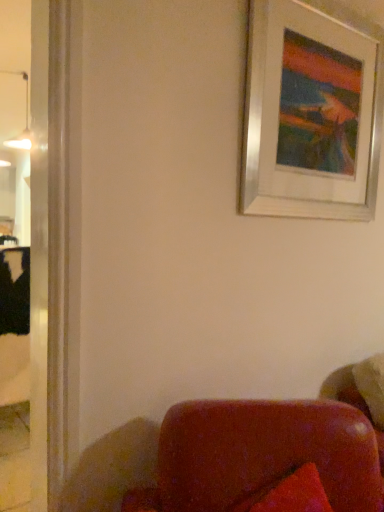
This screenshot has width=384, height=512. Describe the element at coordinates (312, 111) in the screenshot. I see `silver metallic picture frame at upper right` at that location.

Find the location of a particular element. silver metallic picture frame at upper right is located at coordinates (312, 111).

Image resolution: width=384 pixels, height=512 pixels. Describe the element at coordinates (26, 117) in the screenshot. I see `matte white lamp at upper left` at that location.

The width and height of the screenshot is (384, 512). I want to click on matte white lamp at upper left, so click(26, 117).

Where is `silver metallic picture frame at upper right`? This screenshot has height=512, width=384. silver metallic picture frame at upper right is located at coordinates (312, 111).

Is matte white lamp at upper left to the left of silver metallic picture frame at upper right from the viewer's perspective?

Indeed, matte white lamp at upper left is positioned on the left side of silver metallic picture frame at upper right.

Is matte white lamp at upper left closer to the viewer compared to silver metallic picture frame at upper right?

No, matte white lamp at upper left is behind silver metallic picture frame at upper right.

Is point (26, 106) in front of point (315, 187)?

No, (26, 106) is behind (315, 187).

From the image's perspective, between matte white lamp at upper left and silver metallic picture frame at upper right, who is located below?

silver metallic picture frame at upper right, from the image's perspective.

From a real-world perspective, does matte white lamp at upper left stand above silver metallic picture frame at upper right?

Indeed, from a real-world perspective, matte white lamp at upper left stands above silver metallic picture frame at upper right.

Looking at their sizes, would you say matte white lamp at upper left is wider or thinner than silver metallic picture frame at upper right?

matte white lamp at upper left is wider than silver metallic picture frame at upper right.

Can you confirm if matte white lamp at upper left is taller than silver metallic picture frame at upper right?

No.

Does matte white lamp at upper left have a smaller size compared to silver metallic picture frame at upper right?

Correct, matte white lamp at upper left occupies less space than silver metallic picture frame at upper right.

Is matte white lamp at upper left spatially inside silver metallic picture frame at upper right, or outside of it?

matte white lamp at upper left is located beyond the bounds of silver metallic picture frame at upper right.

Is matte white lamp at upper left positioned far away from silver metallic picture frame at upper right?

matte white lamp at upper left is far away from silver metallic picture frame at upper right.

Is matte white lamp at upper left oriented away from silver metallic picture frame at upper right?

That's not correct — matte white lamp at upper left is not looking away from silver metallic picture frame at upper right.

How far apart are matte white lamp at upper left and silver metallic picture frame at upper right?

matte white lamp at upper left is 1.77 meters away from silver metallic picture frame at upper right.

Locate an element on the screen. This screenshot has width=384, height=512. picture frame on the right of matte white lamp at upper left is located at coordinates (312, 111).

Is silver metallic picture frame at upper right at the right side of matte white lamp at upper left?

Correct, you'll find silver metallic picture frame at upper right to the right of matte white lamp at upper left.

Relative to matte white lamp at upper left, is silver metallic picture frame at upper right in front or behind?

silver metallic picture frame at upper right is positioned closer to the viewer than matte white lamp at upper left.

Which is further, (373, 199) or (28, 91)?

The point (28, 91) is farther.

From the image's perspective, which one is positioned lower, silver metallic picture frame at upper right or matte white lamp at upper left?

silver metallic picture frame at upper right.

From a real-world perspective, who is located higher, silver metallic picture frame at upper right or matte white lamp at upper left?

From a 3D spatial view, matte white lamp at upper left is above.

Consider the image. Considering the sizes of objects silver metallic picture frame at upper right and matte white lamp at upper left in the image provided, who is wider, silver metallic picture frame at upper right or matte white lamp at upper left?

With larger width is matte white lamp at upper left.

From their relative heights in the image, would you say silver metallic picture frame at upper right is taller or shorter than matte white lamp at upper left?

Considering their sizes, silver metallic picture frame at upper right has more height than matte white lamp at upper left.

From the picture: Which of these two, silver metallic picture frame at upper right or matte white lamp at upper left, is smaller?

With smaller size is matte white lamp at upper left.

Is silver metallic picture frame at upper right completely or partially outside of matte white lamp at upper left?

silver metallic picture frame at upper right is positioned outside matte white lamp at upper left.

Is silver metallic picture frame at upper right next to matte white lamp at upper left and touching it?

They are not placed beside each other.

Is silver metallic picture frame at upper right facing towards matte white lamp at upper left?

No, silver metallic picture frame at upper right is not turned towards matte white lamp at upper left.

How many degrees apart are the facing directions of silver metallic picture frame at upper right and matte white lamp at upper left?

The angular difference between silver metallic picture frame at upper right and matte white lamp at upper left is 90 degrees.

You are a GUI agent. You are given a task and a screenshot of the screen. Output one action in this format:
    pyautogui.click(x=<x>, y=<y>)
    Task: Click on the picture frame in front of the matte white lamp at upper left
    
    Given the screenshot: What is the action you would take?
    click(x=312, y=111)

Image resolution: width=384 pixels, height=512 pixels. What are the coordinates of `lamp located on the left of silver metallic picture frame at upper right` in the screenshot? It's located at (26, 117).

This screenshot has height=512, width=384. What are the coordinates of `picture frame on the right of matte white lamp at upper left` in the screenshot? It's located at (312, 111).